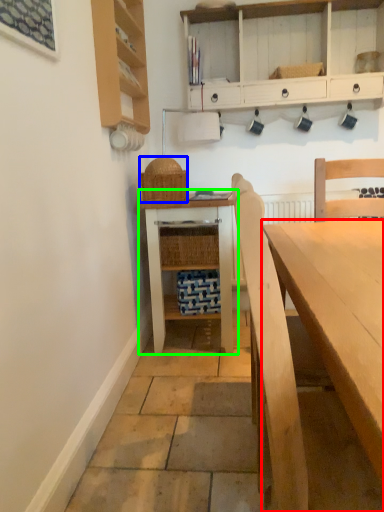
Question: Based on their relative distances, which object is farther from desk (highlighted by a red box)? Choose from picnic basket (highlighted by a blue box) and table (highlighted by a green box).

Choices:
 (A) picnic basket
 (B) table

Answer: (A)